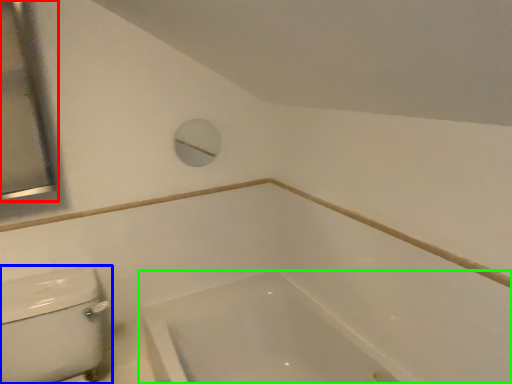
Question: Based on their relative distances, which object is nearer to mirror (highlighted by a red box)? Choose from porcelain (highlighted by a blue box) and bathtub (highlighted by a green box).

Choices:
 (A) porcelain
 (B) bathtub

Answer: (A)